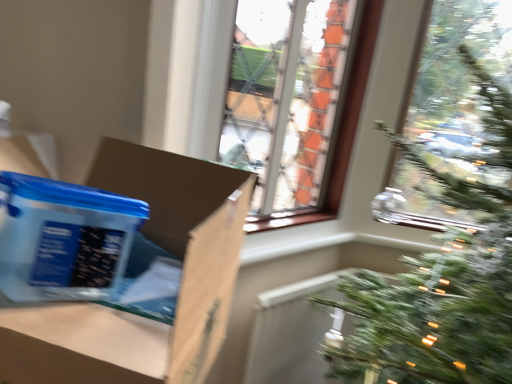
Identify the location of translucent plastic container at left, the first cardboard box viewed from the back. (63, 238).

What do you see at coordinates (63, 238) in the screenshot?
I see `translucent plastic container at left, placed as the 2th cardboard box when sorted from front to back` at bounding box center [63, 238].

What is the approximate height of translucent plastic container at left, the first cardboard box viewed from the back?

translucent plastic container at left, the first cardboard box viewed from the back, is 7.79 inches in height.

Where is `matte brown cardboard at left, positioned as the 1th cardboard box in front-to-back order`? This screenshot has width=512, height=384. matte brown cardboard at left, positioned as the 1th cardboard box in front-to-back order is located at coordinates (180, 290).

Measure the distance between matte brown cardboard at left, marked as the second cardboard box in a back-to-front arrangement, and camera.

16.15 inches.

What do you see at coordinates (180, 290) in the screenshot? The height and width of the screenshot is (384, 512). I see `matte brown cardboard at left, marked as the second cardboard box in a back-to-front arrangement` at bounding box center [180, 290].

Image resolution: width=512 pixels, height=384 pixels. Identify the location of translucent plastic container at left, the first cardboard box viewed from the back. (63, 238).

Can you confirm if translucent plastic container at left, placed as the 2th cardboard box when sorted from front to back, is positioned to the right of matte brown cardboard at left, positioned as the 1th cardboard box in front-to-back order?

No, translucent plastic container at left, placed as the 2th cardboard box when sorted from front to back, is not to the right of matte brown cardboard at left, positioned as the 1th cardboard box in front-to-back order.

Is translucent plastic container at left, the first cardboard box viewed from the back, closer to the viewer compared to matte brown cardboard at left, positioned as the 1th cardboard box in front-to-back order?

No, translucent plastic container at left, the first cardboard box viewed from the back, is further to the viewer.

Is point (17, 234) farther from viewer compared to point (1, 329)?

That is True.

From the image's perspective, is translucent plastic container at left, placed as the 2th cardboard box when sorted from front to back, positioned above or below matte brown cardboard at left, positioned as the 1th cardboard box in front-to-back order?

Clearly, from the image's perspective, translucent plastic container at left, placed as the 2th cardboard box when sorted from front to back, is above matte brown cardboard at left, positioned as the 1th cardboard box in front-to-back order.

From a real-world perspective, does translucent plastic container at left, the first cardboard box viewed from the back, stand above matte brown cardboard at left, positioned as the 1th cardboard box in front-to-back order?

Yes, from a real-world perspective, translucent plastic container at left, the first cardboard box viewed from the back, is above matte brown cardboard at left, positioned as the 1th cardboard box in front-to-back order.

Is translucent plastic container at left, placed as the 2th cardboard box when sorted from front to back, thinner than matte brown cardboard at left, positioned as the 1th cardboard box in front-to-back order?

Yes.

Can you confirm if translucent plastic container at left, placed as the 2th cardboard box when sorted from front to back, is shorter than matte brown cardboard at left, marked as the second cardboard box in a back-to-front arrangement?

Yes.

Looking at this image, considering the relative sizes of translucent plastic container at left, the first cardboard box viewed from the back, and matte brown cardboard at left, marked as the second cardboard box in a back-to-front arrangement, in the image provided, is translucent plastic container at left, the first cardboard box viewed from the back, smaller than matte brown cardboard at left, marked as the second cardboard box in a back-to-front arrangement,?

Yes.

Is translucent plastic container at left, placed as the 2th cardboard box when sorted from front to back, surrounding matte brown cardboard at left, marked as the second cardboard box in a back-to-front arrangement?

No, matte brown cardboard at left, marked as the second cardboard box in a back-to-front arrangement, is not surrounded by translucent plastic container at left, placed as the 2th cardboard box when sorted from front to back.

Are translucent plastic container at left, the first cardboard box viewed from the back, and matte brown cardboard at left, positioned as the 1th cardboard box in front-to-back order, far apart?

No, translucent plastic container at left, the first cardboard box viewed from the back, is in close proximity to matte brown cardboard at left, positioned as the 1th cardboard box in front-to-back order.

Is translucent plastic container at left, placed as the 2th cardboard box when sorted from front to back, oriented towards matte brown cardboard at left, marked as the second cardboard box in a back-to-front arrangement?

Yes, translucent plastic container at left, placed as the 2th cardboard box when sorted from front to back, is oriented towards matte brown cardboard at left, marked as the second cardboard box in a back-to-front arrangement.

How many degrees apart are the facing directions of translucent plastic container at left, the first cardboard box viewed from the back, and matte brown cardboard at left, marked as the second cardboard box in a back-to-front arrangement?

The angle between the facing direction of translucent plastic container at left, the first cardboard box viewed from the back, and the facing direction of matte brown cardboard at left, marked as the second cardboard box in a back-to-front arrangement, is 89.6 degrees.

This screenshot has height=384, width=512. Identify the location of cardboard box below the translucent plastic container at left, the first cardboard box viewed from the back (from a real-world perspective). (180, 290).

Considering the relative positions of matte brown cardboard at left, positioned as the 1th cardboard box in front-to-back order, and translucent plastic container at left, the first cardboard box viewed from the back, in the image provided, is matte brown cardboard at left, positioned as the 1th cardboard box in front-to-back order, to the left of translucent plastic container at left, the first cardboard box viewed from the back, from the viewer's perspective?

In fact, matte brown cardboard at left, positioned as the 1th cardboard box in front-to-back order, is to the right of translucent plastic container at left, the first cardboard box viewed from the back.

Is matte brown cardboard at left, marked as the second cardboard box in a back-to-front arrangement, further to camera compared to translucent plastic container at left, placed as the 2th cardboard box when sorted from front to back?

No, matte brown cardboard at left, marked as the second cardboard box in a back-to-front arrangement, is in front of translucent plastic container at left, placed as the 2th cardboard box when sorted from front to back.

Which is nearer, [178,211] or [80,210]?

Clearly, point [178,211] is more distant from the camera than point [80,210].

From the image's perspective, is matte brown cardboard at left, positioned as the 1th cardboard box in front-to-back order, below translucent plastic container at left, placed as the 2th cardboard box when sorted from front to back?

Correct, matte brown cardboard at left, positioned as the 1th cardboard box in front-to-back order, appears lower than translucent plastic container at left, placed as the 2th cardboard box when sorted from front to back, in the image.

From a real-world perspective, who is located lower, matte brown cardboard at left, positioned as the 1th cardboard box in front-to-back order, or translucent plastic container at left, the first cardboard box viewed from the back?

matte brown cardboard at left, positioned as the 1th cardboard box in front-to-back order.

Can you confirm if matte brown cardboard at left, positioned as the 1th cardboard box in front-to-back order, is wider than translucent plastic container at left, placed as the 2th cardboard box when sorted from front to back?

Yes.

In the scene shown: Who is shorter, matte brown cardboard at left, positioned as the 1th cardboard box in front-to-back order, or translucent plastic container at left, placed as the 2th cardboard box when sorted from front to back?

translucent plastic container at left, placed as the 2th cardboard box when sorted from front to back, is shorter.

Considering the relative sizes of matte brown cardboard at left, positioned as the 1th cardboard box in front-to-back order, and translucent plastic container at left, the first cardboard box viewed from the back, in the image provided, is matte brown cardboard at left, positioned as the 1th cardboard box in front-to-back order, bigger than translucent plastic container at left, the first cardboard box viewed from the back,?

Indeed, matte brown cardboard at left, positioned as the 1th cardboard box in front-to-back order, has a larger size compared to translucent plastic container at left, the first cardboard box viewed from the back.

From the picture: Is matte brown cardboard at left, marked as the second cardboard box in a back-to-front arrangement, located outside translucent plastic container at left, the first cardboard box viewed from the back?

matte brown cardboard at left, marked as the second cardboard box in a back-to-front arrangement, lies outside translucent plastic container at left, the first cardboard box viewed from the back,'s area.

Would you say matte brown cardboard at left, marked as the second cardboard box in a back-to-front arrangement, is a long distance from translucent plastic container at left, the first cardboard box viewed from the back?

That's not correct — matte brown cardboard at left, marked as the second cardboard box in a back-to-front arrangement, is a little close to translucent plastic container at left, the first cardboard box viewed from the back.

Is matte brown cardboard at left, marked as the second cardboard box in a back-to-front arrangement, turned away from translucent plastic container at left, the first cardboard box viewed from the back?

That's right, matte brown cardboard at left, marked as the second cardboard box in a back-to-front arrangement, is facing away from translucent plastic container at left, the first cardboard box viewed from the back.

What's the angular difference between matte brown cardboard at left, marked as the second cardboard box in a back-to-front arrangement, and translucent plastic container at left, the first cardboard box viewed from the back,'s facing directions?

The facing directions of matte brown cardboard at left, marked as the second cardboard box in a back-to-front arrangement, and translucent plastic container at left, the first cardboard box viewed from the back, are 89.6 degrees apart.

How distant is matte brown cardboard at left, positioned as the 1th cardboard box in front-to-back order, from translucent plastic container at left, placed as the 2th cardboard box when sorted from front to back?

matte brown cardboard at left, positioned as the 1th cardboard box in front-to-back order, and translucent plastic container at left, placed as the 2th cardboard box when sorted from front to back, are 4.34 inches apart from each other.

The width and height of the screenshot is (512, 384). Find the location of `cardboard box on the right of translucent plastic container at left, placed as the 2th cardboard box when sorted from front to back`. cardboard box on the right of translucent plastic container at left, placed as the 2th cardboard box when sorted from front to back is located at coordinates (180, 290).

Identify the location of cardboard box lying behind the matte brown cardboard at left, positioned as the 1th cardboard box in front-to-back order. Image resolution: width=512 pixels, height=384 pixels. (63, 238).

Identify the location of cardboard box that is above the matte brown cardboard at left, marked as the second cardboard box in a back-to-front arrangement (from the image's perspective). This screenshot has height=384, width=512. (63, 238).